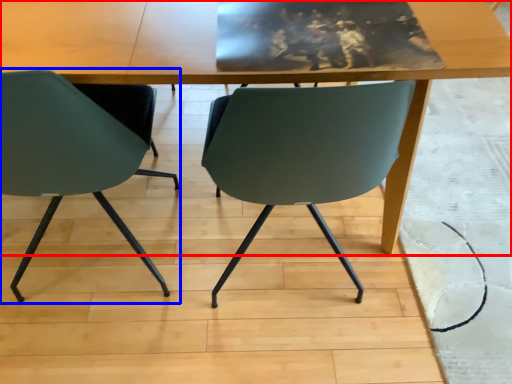
Question: Which object appears closest to the camera in this image, table (highlighted by a red box) or chair (highlighted by a blue box)?

Choices:
 (A) table
 (B) chair

Answer: (B)